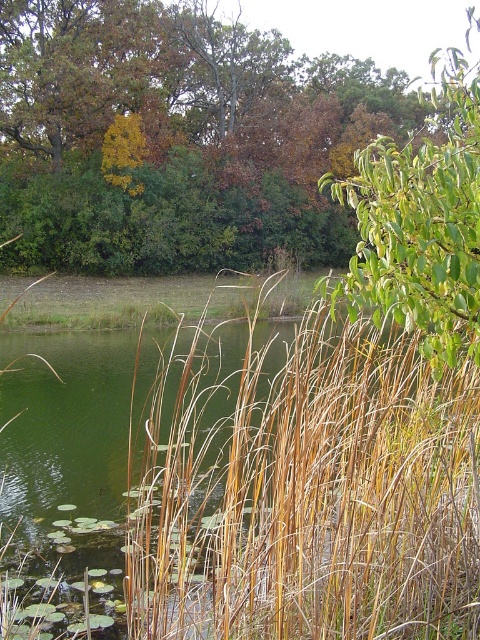
Consider the image. You are standing at the edge of the pond and want to reach both points in the water. Which point, point (x=325, y=518) or point (x=338, y=88), is closer to you?

Point (x=325, y=518) is closer to you than point (x=338, y=88).

You are standing in the middle of the pond and want to reach the shore. Which direction should you walk to avoid the brown leafy tree at upper center and the green leafy tree at upper right?

The brown leafy tree at upper center is located below the green leafy tree at upper right. To avoid both, walk towards the lower part of the pond away from the trees.

You are a gardener planning to mow the area around the pond. You need to know which area is smaller between the brown dry grass at center and the green leafy tree at upper right to prioritize your work. Which one should you tackle first?

The brown dry grass at center occupies less space than the green leafy tree at upper right, so you should tackle the brown dry grass at center first since it covers a smaller area and can be managed more quickly.